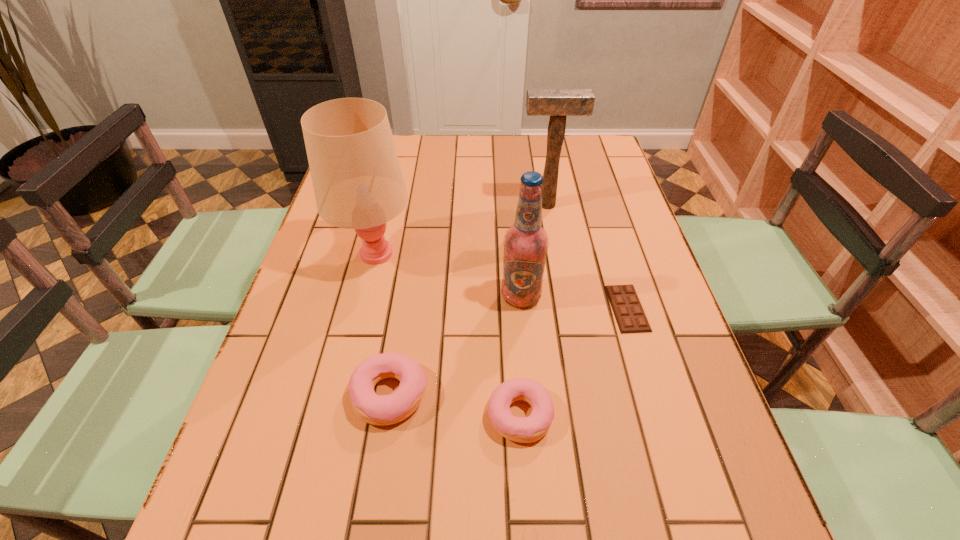
Find the location of a particular element. free region located 0.120m on the left of the right doughnut is located at coordinates (425, 415).

The image size is (960, 540). Find the location of `vacant region located 0.380m on the front of the lampshade`. vacant region located 0.380m on the front of the lampshade is located at coordinates (333, 432).

Where is `vacant area situated 0.080m on the left of the chocolate bar`? The width and height of the screenshot is (960, 540). vacant area situated 0.080m on the left of the chocolate bar is located at coordinates (576, 308).

Find the location of a particular element. The image size is (960, 540). free space located on the front of the mallet is located at coordinates click(x=557, y=267).

You are a GUI agent. You are given a task and a screenshot of the screen. Output one action in this format:
    pyautogui.click(x=<x>, y=<y>)
    Task: Click on the vacant region located on the back of the alcohol
    
    Given the screenshot: What is the action you would take?
    pyautogui.click(x=518, y=265)

Find the location of a particular element. object located in the near edge section of the desktop is located at coordinates (529, 429).

Where is `object located in the left edge section of the desktop`? The width and height of the screenshot is (960, 540). object located in the left edge section of the desktop is located at coordinates (358, 184).

You are a GUI agent. You are given a task and a screenshot of the screen. Output one action in this format:
    pyautogui.click(x=<x>, y=<y>)
    Task: Click on the object located in the right edge section of the desktop
    This screenshot has width=960, height=540.
    Given the screenshot: What is the action you would take?
    pyautogui.click(x=629, y=314)

I want to click on vacant space at the left edge of the desktop, so pyautogui.click(x=300, y=283).

Locate an element on the screen. The height and width of the screenshot is (540, 960). vacant space at the right edge of the desktop is located at coordinates (573, 178).